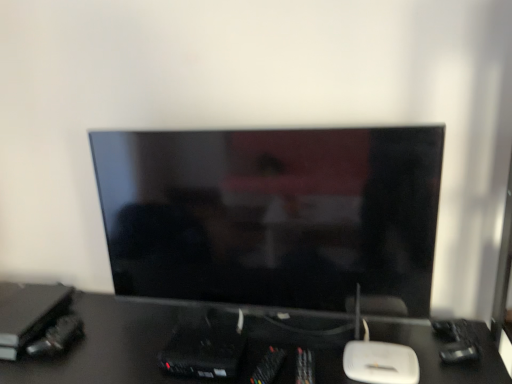
The height and width of the screenshot is (384, 512). Identify the location of vacant space situated above black glossy desk at center (from a real-world perspective). (240, 339).